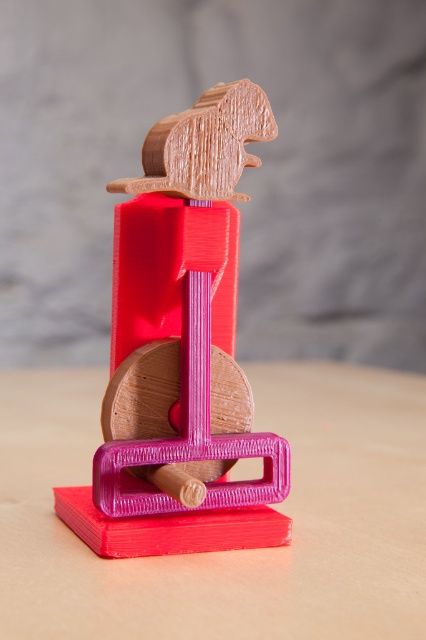
Question: Is the position of pink matte table at center more distant than that of matte wood mouse at center?

Choices:
 (A) yes
 (B) no

Answer: (B)

Question: Which of the following is the farthest from the observer?

Choices:
 (A) matte wood mouse at center
 (B) pink matte table at center

Answer: (A)

Question: Where is pink matte table at center located in relation to matte wood mouse at center in the image?

Choices:
 (A) below
 (B) above

Answer: (A)

Question: Does pink matte table at center have a lesser width compared to matte wood mouse at center?

Choices:
 (A) yes
 (B) no

Answer: (B)

Question: Which of the following is the closest to the observer?

Choices:
 (A) (172, 262)
 (B) (259, 403)

Answer: (A)